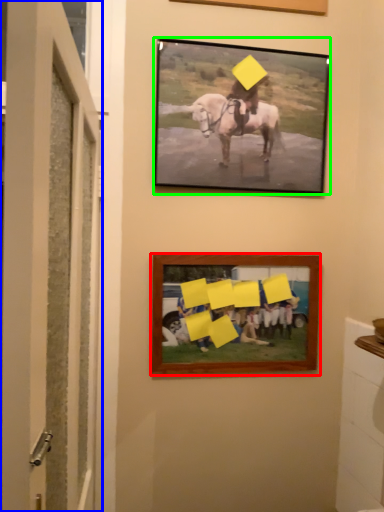
Question: Considering the real-world distances, which object is closest to picture frame (highlighted by a red box)? door (highlighted by a blue box) or picture frame (highlighted by a green box).

Choices:
 (A) door
 (B) picture frame

Answer: (B)